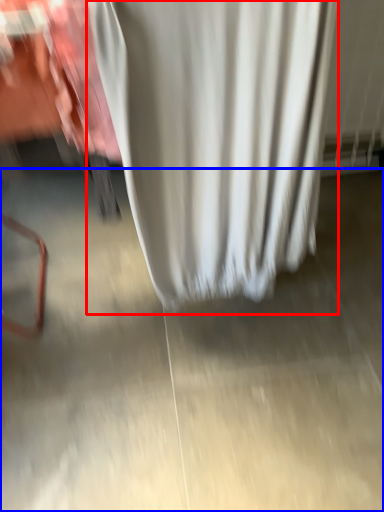
Question: Which object is closer to the camera taking this photo, curtain (highlighted by a red box) or concrete (highlighted by a blue box)?

Choices:
 (A) curtain
 (B) concrete

Answer: (A)